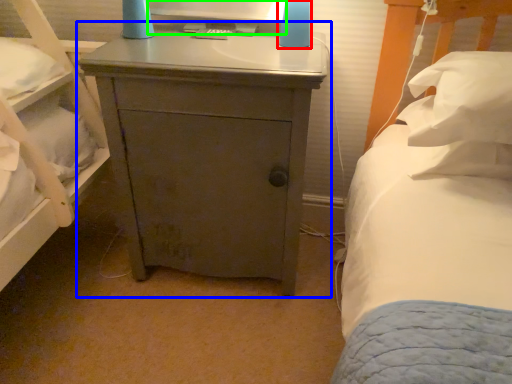
Question: Considering the real-world distances, which object is farthest from bedside lamp (highlighted by a red box)? nightstand (highlighted by a blue box) or computer monitor (highlighted by a green box)?

Choices:
 (A) nightstand
 (B) computer monitor

Answer: (A)